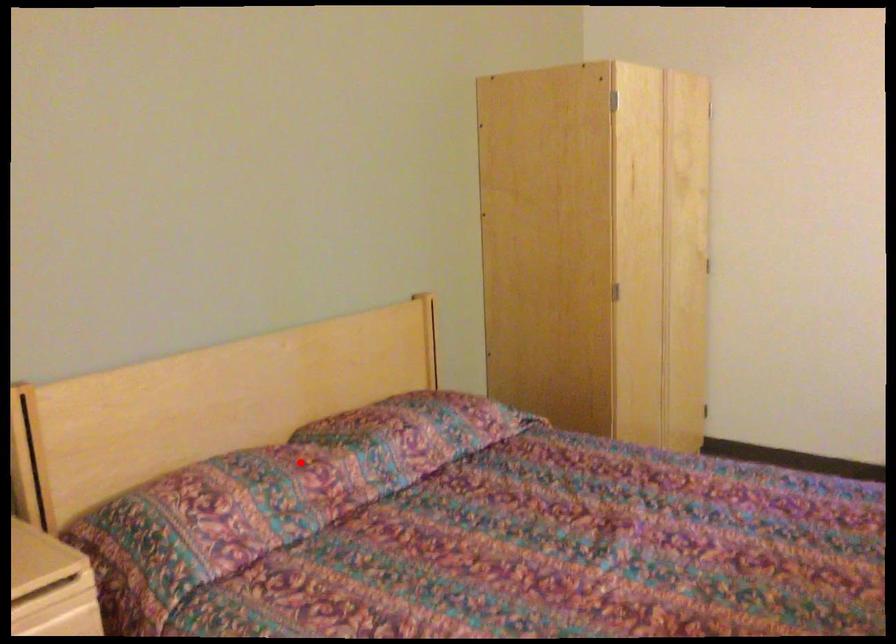
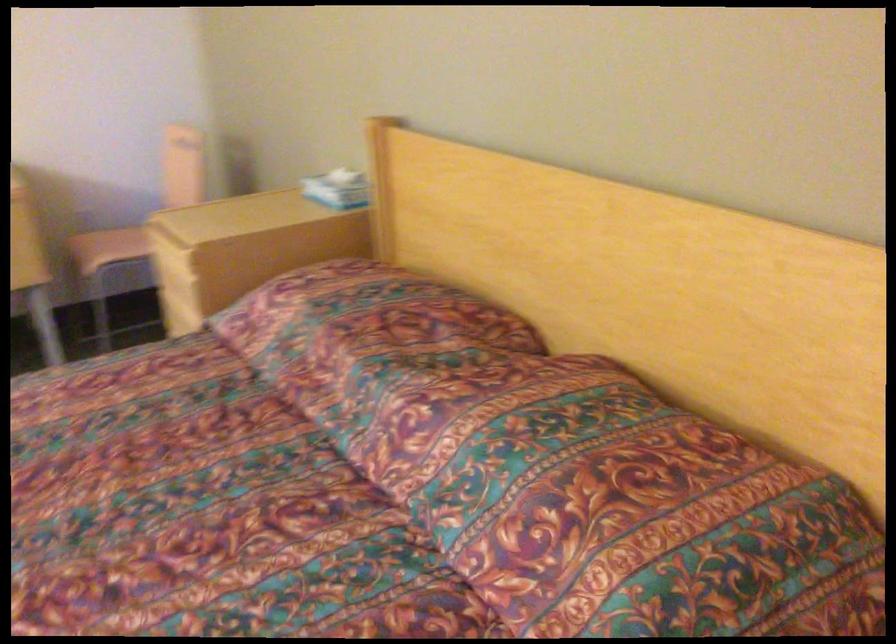
Question: I am providing you with two images of the same scene from different viewpoints. A red point is shown in image1. For the corresponding object point in image2, is it positioned nearer or farther from the camera?

Choices:
 (A) Nearer
 (B) Farther

Answer: (A)